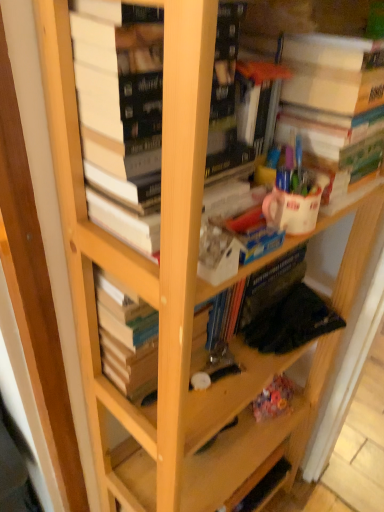
Question: Is white matte paper at upper right, marked as the third book in a left-to-right arrangement, beside hardcover book at center, which ranks as the 3th book in right-to-left order?

Choices:
 (A) yes
 (B) no

Answer: (B)

Question: Is white matte paper at upper right, acting as the first book starting from the right, aimed at hardcover book at center, which ranks as the 3th book in right-to-left order?

Choices:
 (A) no
 (B) yes

Answer: (A)

Question: From the image's perspective, does white matte paper at upper right, acting as the first book starting from the right, appear higher than hardcover book at center, which ranks as the 3th book in right-to-left order?

Choices:
 (A) no
 (B) yes

Answer: (B)

Question: From a real-world perspective, is white matte paper at upper right, acting as the first book starting from the right, beneath hardcover book at center, positioned as the 1th book in left-to-right order?

Choices:
 (A) yes
 (B) no

Answer: (B)

Question: Can you confirm if white matte paper at upper right, marked as the third book in a left-to-right arrangement, is smaller than hardcover book at center, positioned as the 1th book in left-to-right order?

Choices:
 (A) no
 (B) yes

Answer: (A)

Question: Considering the positions of hardcover books at center, marked as the second book in a right-to-left arrangement, and white glossy coffee cup at upper center in the image, is hardcover books at center, marked as the second book in a right-to-left arrangement, bigger or smaller than white glossy coffee cup at upper center?

Choices:
 (A) big
 (B) small

Answer: (A)

Question: Visually, is hardcover books at center, marked as the second book in a right-to-left arrangement, positioned to the left or to the right of white glossy coffee cup at upper center?

Choices:
 (A) right
 (B) left

Answer: (B)

Question: From a real-world perspective, is hardcover books at center, marked as the second book in a right-to-left arrangement, above or below white glossy coffee cup at upper center?

Choices:
 (A) above
 (B) below

Answer: (A)

Question: Considering the positions of point (155, 201) and point (294, 232), is point (155, 201) closer or farther from the camera than point (294, 232)?

Choices:
 (A) closer
 (B) farther

Answer: (A)

Question: From a real-world perspective, is white matte paper at upper right, marked as the third book in a left-to-right arrangement, physically located above or below hardcover book at center, positioned as the 1th book in left-to-right order?

Choices:
 (A) above
 (B) below

Answer: (A)

Question: Visually, is white matte paper at upper right, acting as the first book starting from the right, positioned to the left or to the right of hardcover book at center, which ranks as the 3th book in right-to-left order?

Choices:
 (A) right
 (B) left

Answer: (A)

Question: Is white matte paper at upper right, marked as the third book in a left-to-right arrangement, situated inside hardcover book at center, positioned as the 1th book in left-to-right order, or outside?

Choices:
 (A) outside
 (B) inside

Answer: (A)

Question: Does point (367, 66) appear closer or farther from the camera than point (102, 367)?

Choices:
 (A) farther
 (B) closer

Answer: (B)

Question: Based on their positions, is white glossy coffee cup at upper center located to the left or right of white matte paper at upper right, acting as the first book starting from the right?

Choices:
 (A) right
 (B) left

Answer: (B)

Question: From a real-world perspective, is white glossy coffee cup at upper center physically located above or below white matte paper at upper right, acting as the first book starting from the right?

Choices:
 (A) above
 (B) below

Answer: (B)